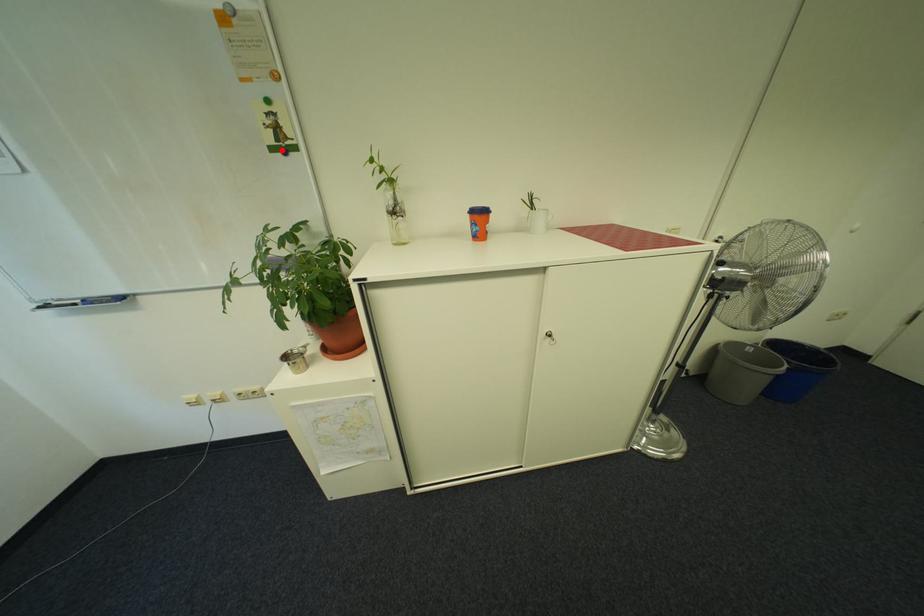
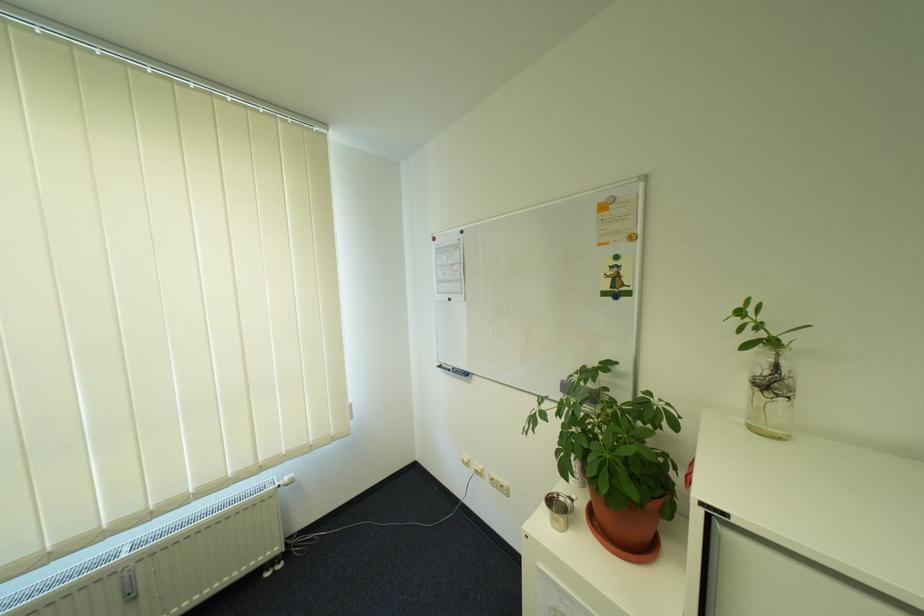
Where in the second image is the point corresponding to the highlighted location from the first image?

(614, 294)